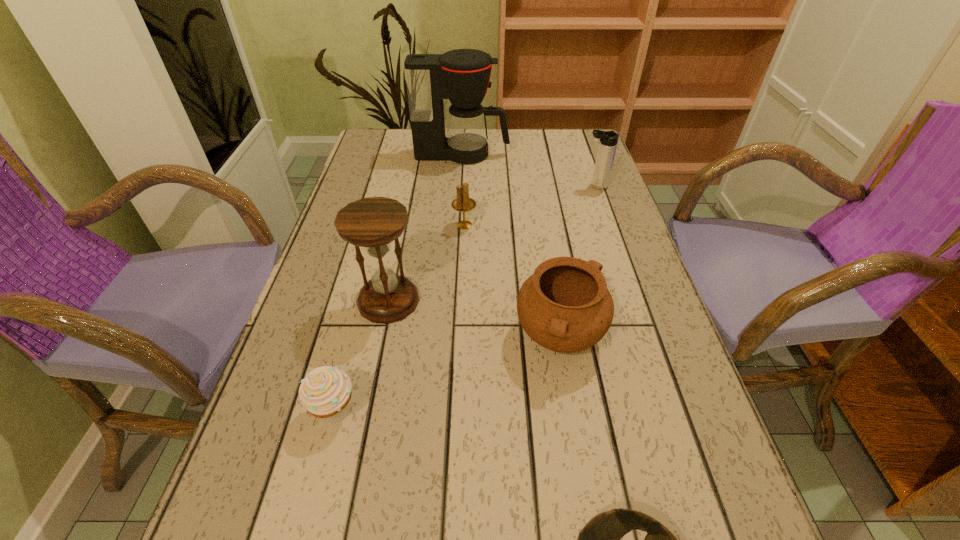
At what (x,y) coordinates should I click in order to perform the action: click on thermos bottle that is at the right edge. Please return your answer as a coordinate pair (x, y). Looking at the image, I should click on (608, 140).

Image resolution: width=960 pixels, height=540 pixels. I want to click on pottery positioned at the right edge, so click(565, 306).

Locate an element on the screen. The height and width of the screenshot is (540, 960). vacant region at the far edge of the desktop is located at coordinates (524, 154).

In the image, there is a desktop. Where is `vacant space at the left edge`? vacant space at the left edge is located at coordinates (352, 171).

The image size is (960, 540). Identify the location of vacant space at the right edge of the desktop. (644, 318).

The height and width of the screenshot is (540, 960). Find the location of `vacant space at the far left corner of the desktop`. vacant space at the far left corner of the desktop is located at coordinates (394, 139).

Where is `vacant space at the far right corner of the desktop`? vacant space at the far right corner of the desktop is located at coordinates click(580, 158).

Find the location of a particular element. The width and height of the screenshot is (960, 540). vacant region between the pottery and the second nearest object is located at coordinates (447, 374).

You are a GUI agent. You are given a task and a screenshot of the screen. Output one action in this format:
    pyautogui.click(x=<x>, y=<y>)
    Task: Click on the free spot between the coffee maker and the second tallest object
    
    Given the screenshot: What is the action you would take?
    pyautogui.click(x=425, y=227)

At what (x,y) coordinates should I click in order to perform the action: click on unoccupied position between the farthest object and the hourglass. Please return your answer as a coordinate pair (x, y). The image size is (960, 540). Looking at the image, I should click on (425, 227).